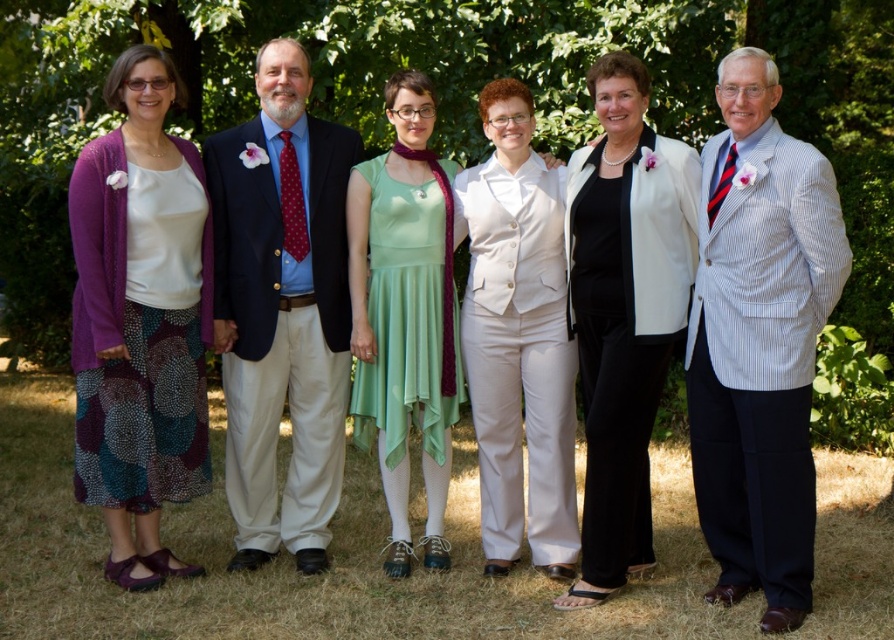
Is point (141, 232) farther from viewer compared to point (622, 253)?

Yes, it is behind point (622, 253).

From the picture: Which of these two, purple cardigan at left or white matte blazer at center, stands shorter?

purple cardigan at left

Which is behind, point (190, 272) or point (602, 240)?

Point (190, 272)

Locate an element on the screen. The width and height of the screenshot is (894, 640). purple cardigan at left is located at coordinates [x=140, y=321].

Between purple cardigan at left and white smooth vest at center, which one appears on the right side from the viewer's perspective?

white smooth vest at center is more to the right.

How far apart are purple cardigan at left and white smooth vest at center?

purple cardigan at left is 7.17 feet from white smooth vest at center.

Where is `purple cardigan at left`? This screenshot has height=640, width=894. purple cardigan at left is located at coordinates (140, 321).

Image resolution: width=894 pixels, height=640 pixels. I want to click on purple cardigan at left, so click(140, 321).

Consider the image. Does white matte blazer at center come in front of white smooth vest at center?

Yes.

Does point (595, 316) lie behind point (562, 410)?

No.

The height and width of the screenshot is (640, 894). In order to click on white matte blazer at center in this screenshot , I will do `click(623, 310)`.